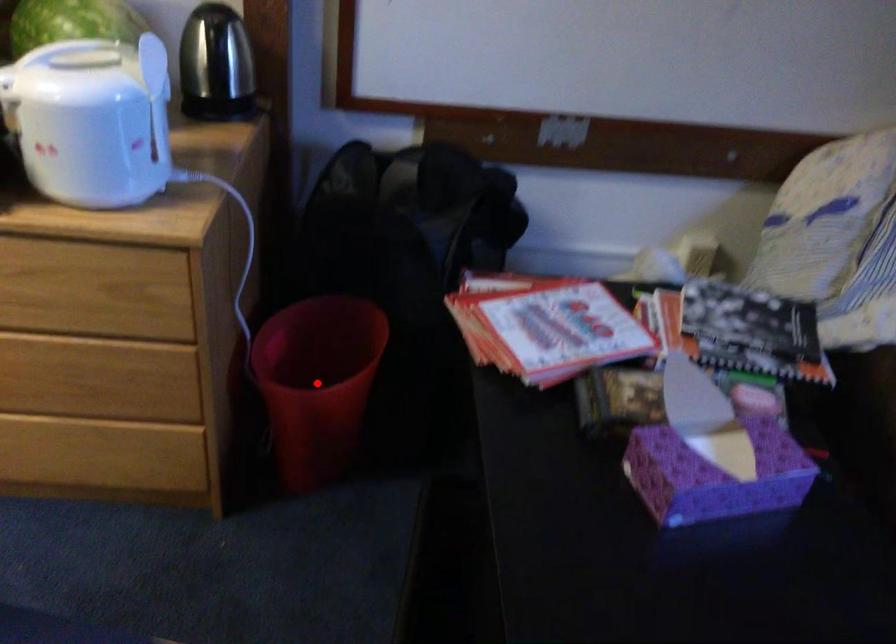
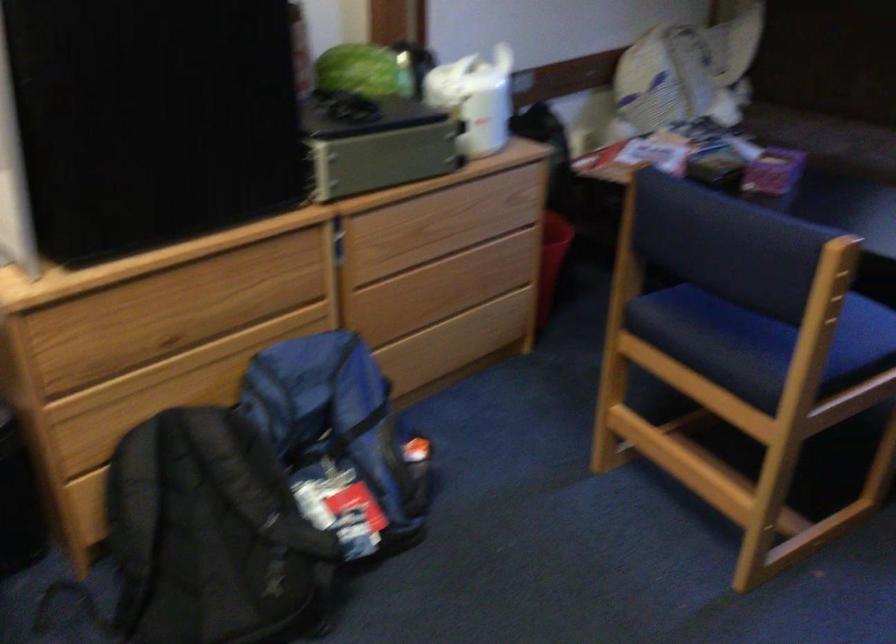
Question: I am providing you with two images of the same scene from different viewpoints. A red point is marked on the first image. Can you still see the location of the red point in image 2?

Choices:
 (A) Yes
 (B) No

Answer: (B)